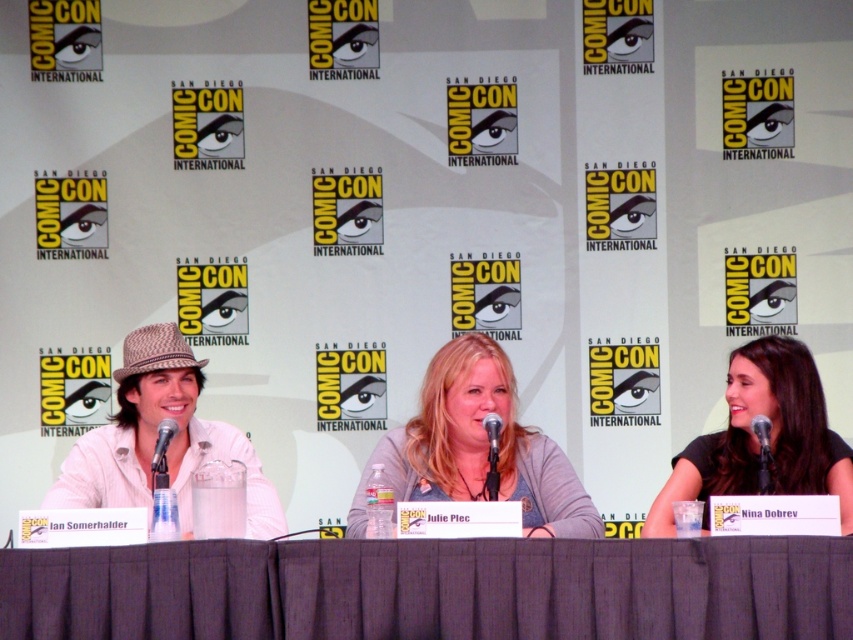
Question: Which of the following is the closest to the observer?

Choices:
 (A) (497, 468)
 (B) (122, 468)

Answer: (A)

Question: Is gray cotton shirt at center bigger than black metallic microphone at center?

Choices:
 (A) yes
 (B) no

Answer: (A)

Question: Which object is farther from the camera taking this photo?

Choices:
 (A) black metallic microphone at center
 (B) gray fabric table at center

Answer: (A)

Question: Which object is farther from the camera taking this photo?

Choices:
 (A) gray fabric table at center
 (B) white woven hat at left
 (C) matte black microphone at left

Answer: (C)

Question: Can you confirm if white woven hat at left is wider than matte black microphone at center?

Choices:
 (A) yes
 (B) no

Answer: (A)

Question: Considering the relative positions of white woven hat at left and matte black microphone at left in the image provided, where is white woven hat at left located with respect to matte black microphone at left?

Choices:
 (A) below
 (B) above

Answer: (A)